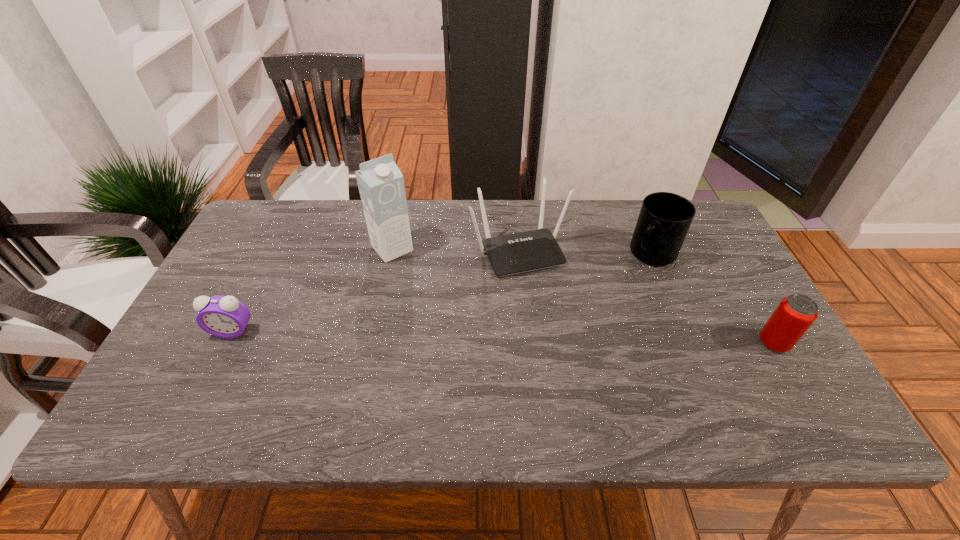
Find the location of a particular element. This screenshot has width=960, height=540. vacant space located on the front label of the carton is located at coordinates (462, 329).

At what (x,y) coordinates should I click in order to perform the action: click on vacant space situated 0.240m on the front label of the carton. Please return your answer as a coordinate pair (x, y). Image resolution: width=960 pixels, height=540 pixels. Looking at the image, I should click on (447, 312).

The image size is (960, 540). Identify the location of vacant area situated on the front-facing side of the router. (571, 350).

Locate an element on the screen. This screenshot has width=960, height=540. vacant space situated on the front-facing side of the router is located at coordinates (564, 338).

The width and height of the screenshot is (960, 540). I want to click on free space located 0.310m on the front-facing side of the router, so click(582, 371).

Locate an element on the screen. The width and height of the screenshot is (960, 540). free spot located on the side of the mug with the handle is located at coordinates (626, 282).

Identify the location of vacant space located 0.190m on the side of the mug with the handle. (605, 304).

Locate an element on the screen. This screenshot has height=540, width=960. vacant space located on the side of the mug with the handle is located at coordinates (626, 282).

The width and height of the screenshot is (960, 540). Identify the location of carton that is at the far edge. (381, 185).

Where is `router positioned at the far edge`? The image size is (960, 540). router positioned at the far edge is located at coordinates [510, 254].